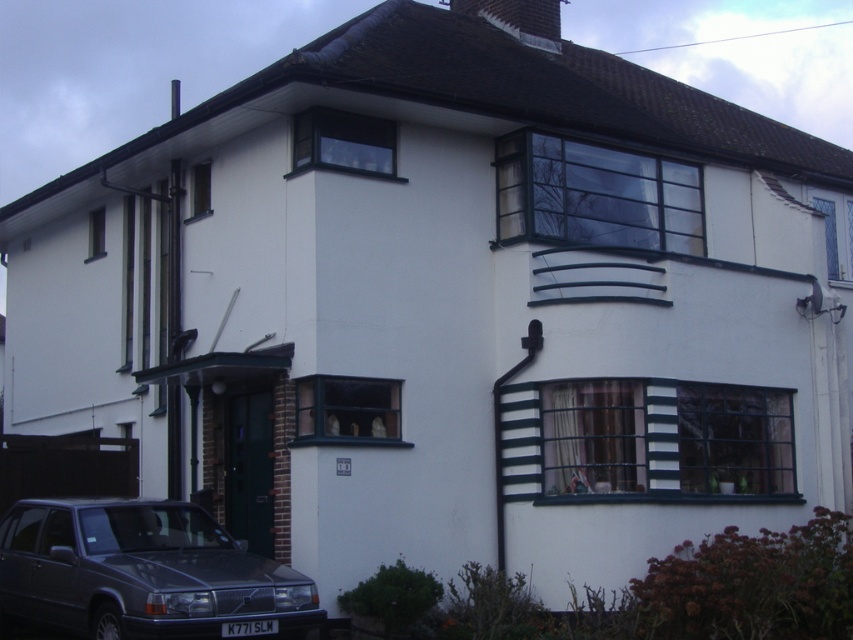
Question: Among these points, which one is farthest from the camera?

Choices:
 (A) (524, 28)
 (B) (84, 604)

Answer: (A)

Question: Observing the image, what is the correct spatial positioning of dark gray metallic car at lower left in reference to dark gray slate chimney at upper center?

Choices:
 (A) above
 (B) below

Answer: (B)

Question: Observing the image, what is the correct spatial positioning of dark gray metallic car at lower left in reference to dark gray slate chimney at upper center?

Choices:
 (A) below
 (B) above

Answer: (A)

Question: Considering the relative positions of dark gray metallic car at lower left and dark gray slate chimney at upper center in the image provided, where is dark gray metallic car at lower left located with respect to dark gray slate chimney at upper center?

Choices:
 (A) above
 (B) below

Answer: (B)

Question: Which point is farther from the camera taking this photo?

Choices:
 (A) (541, 8)
 (B) (314, 614)

Answer: (A)